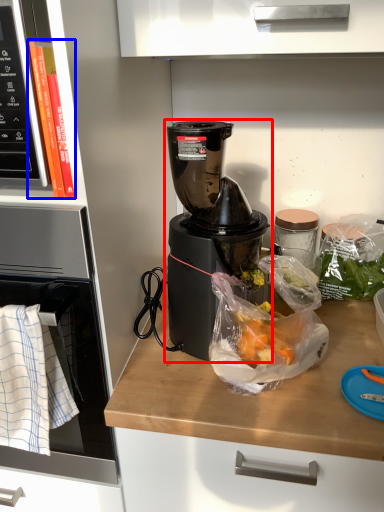
Question: Which object appears farthest to the camera in this image, blender (highlighted by a red box) or book (highlighted by a blue box)?

Choices:
 (A) blender
 (B) book

Answer: (A)